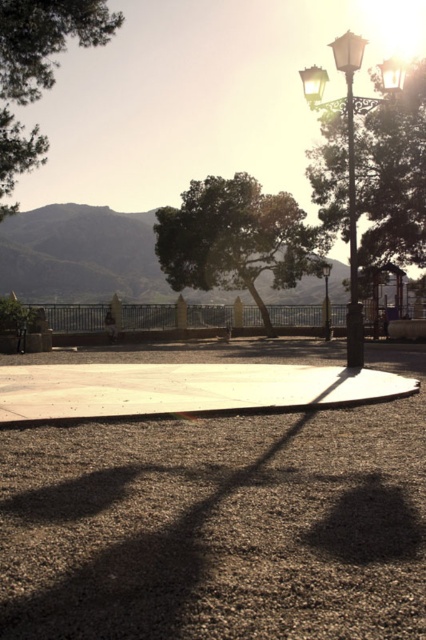
Question: Can you confirm if green leafy tree at upper left is bigger than metallic streetlight at upper right?

Choices:
 (A) yes
 (B) no

Answer: (B)

Question: Is green glass street light at upper right positioned in front of metallic streetlight at center?

Choices:
 (A) yes
 (B) no

Answer: (A)

Question: Based on their relative distances, which object is nearer to the green leafy tree at upper left?

Choices:
 (A) green glass street light at upper right
 (B) metallic streetlight at upper right
 (C) metallic streetlight at center
 (D) green leafy tree at center

Answer: (B)

Question: Can you confirm if green leafy tree at center is positioned above green glass street light at upper right?

Choices:
 (A) yes
 (B) no

Answer: (B)

Question: Which object is closer to the camera taking this photo?

Choices:
 (A) metallic streetlight at upper right
 (B) green leafy tree at upper left
 (C) metallic streetlight at center

Answer: (A)

Question: Among these points, which one is nearest to the camera?

Choices:
 (A) (348, 368)
 (B) (382, 80)
 (C) (330, 323)
 (D) (115, 17)

Answer: (A)